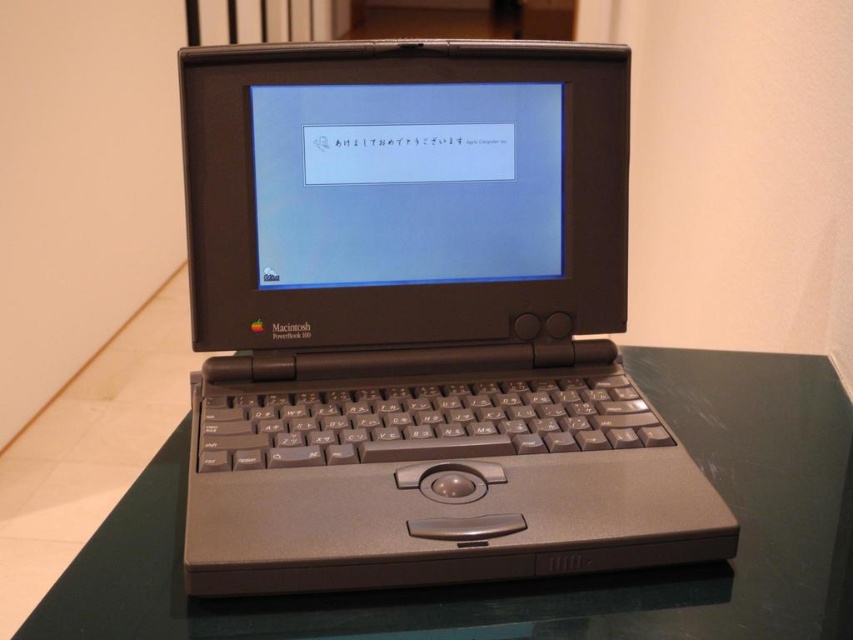
Is point (550, 628) farther from viewer compared to point (410, 122)?

No, it is not.

Can you confirm if transparent glass table at center is positioned to the right of matte plastic screen at center?

Indeed, transparent glass table at center is positioned on the right side of matte plastic screen at center.

Locate an element on the screen. The height and width of the screenshot is (640, 853). transparent glass table at center is located at coordinates (543, 579).

Who is positioned more to the right, matte black laptop at center or transparent glass table at center?

transparent glass table at center

Describe the element at coordinates (418, 321) in the screenshot. The height and width of the screenshot is (640, 853). I see `matte black laptop at center` at that location.

Does point (683, 552) lie in front of point (717, 616)?

No.

The height and width of the screenshot is (640, 853). I want to click on matte black laptop at center, so click(418, 321).

Between matte black laptop at center and matte plastic screen at center, which one is positioned lower?

matte black laptop at center is lower down.

Does matte black laptop at center have a smaller size compared to matte plastic screen at center?

No, matte black laptop at center is not smaller than matte plastic screen at center.

You are a GUI agent. You are given a task and a screenshot of the screen. Output one action in this format:
    pyautogui.click(x=<x>, y=<y>)
    Task: Click on the matte black laptop at center
    This screenshot has width=853, height=640.
    Given the screenshot: What is the action you would take?
    pyautogui.click(x=418, y=321)

The height and width of the screenshot is (640, 853). Find the location of `matte black laptop at center`. matte black laptop at center is located at coordinates (418, 321).